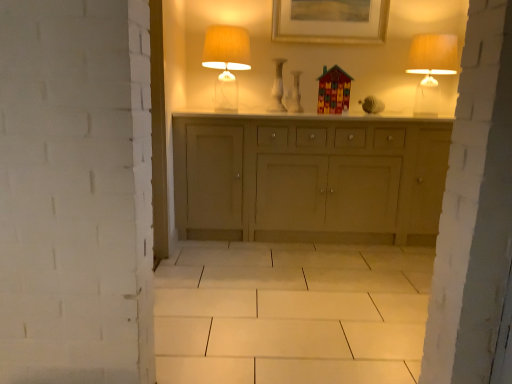
Question: Is matte cream table lamp at upper right, the 1th table lamp from the right, positioned with its back to white glossy vase at center?

Choices:
 (A) no
 (B) yes

Answer: (A)

Question: Can you see matte cream table lamp at upper right, the 1th table lamp from the right, touching white glossy vase at center?

Choices:
 (A) yes
 (B) no

Answer: (B)

Question: Does matte cream table lamp at upper right, which appears as the second table lamp when viewed from the left, have a lesser width compared to white glossy vase at center?

Choices:
 (A) yes
 (B) no

Answer: (B)

Question: Does matte cream table lamp at upper right, which appears as the second table lamp when viewed from the left, lie behind white glossy vase at center?

Choices:
 (A) yes
 (B) no

Answer: (B)

Question: Is white glossy vase at center completely or partially inside matte cream table lamp at upper right, which appears as the second table lamp when viewed from the left?

Choices:
 (A) no
 (B) yes

Answer: (A)

Question: Is matte cream table lamp at upper right, the 1th table lamp from the right, located outside translucent glass table lamp at upper center, marked as the 1th table lamp in a left-to-right arrangement?

Choices:
 (A) yes
 (B) no

Answer: (A)

Question: Can you confirm if matte cream table lamp at upper right, the 1th table lamp from the right, is wider than translucent glass table lamp at upper center, marked as the 1th table lamp in a left-to-right arrangement?

Choices:
 (A) no
 (B) yes

Answer: (B)

Question: Is matte cream table lamp at upper right, which appears as the second table lamp when viewed from the left, shorter than translucent glass table lamp at upper center, which is the second table lamp in right-to-left order?

Choices:
 (A) no
 (B) yes

Answer: (B)

Question: From the image's perspective, is matte cream table lamp at upper right, the 1th table lamp from the right, on top of translucent glass table lamp at upper center, which is the second table lamp in right-to-left order?

Choices:
 (A) no
 (B) yes

Answer: (A)

Question: Can you confirm if matte cream table lamp at upper right, which appears as the second table lamp when viewed from the left, is positioned to the right of translucent glass table lamp at upper center, which is the second table lamp in right-to-left order?

Choices:
 (A) yes
 (B) no

Answer: (A)

Question: Considering the relative sizes of matte cream table lamp at upper right, the 1th table lamp from the right, and translucent glass table lamp at upper center, marked as the 1th table lamp in a left-to-right arrangement, in the image provided, is matte cream table lamp at upper right, the 1th table lamp from the right, taller than translucent glass table lamp at upper center, marked as the 1th table lamp in a left-to-right arrangement,?

Choices:
 (A) yes
 (B) no

Answer: (B)

Question: Is the position of translucent glass table lamp at upper center, which is the second table lamp in right-to-left order, less distant than that of white glossy vase at center?

Choices:
 (A) no
 (B) yes

Answer: (B)